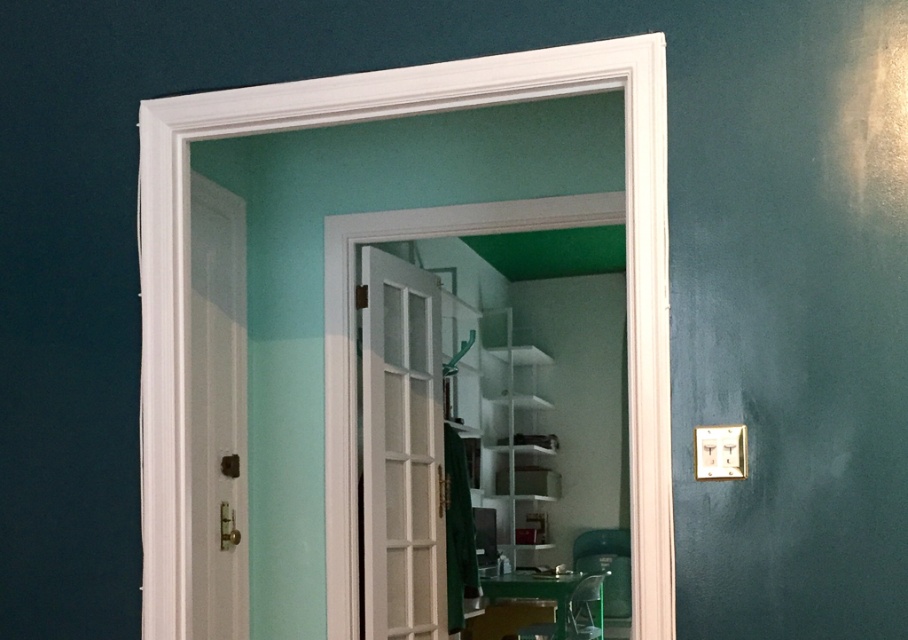
Is white glossy door at center to the left of white glossy bookshelf at center from the viewer's perspective?

Indeed, white glossy door at center is positioned on the left side of white glossy bookshelf at center.

Is white glossy door at center wider than white glossy bookshelf at center?

Incorrect, white glossy door at center's width does not surpass white glossy bookshelf at center's.

Does point (377, 388) come farther from viewer compared to point (522, 346)?

No, (377, 388) is in front of (522, 346).

This screenshot has width=908, height=640. I want to click on white glossy door at center, so click(x=401, y=451).

Is white glossy door at left further to the viewer compared to white glossy bookshelf at center?

That is False.

Between point (229, 460) and point (531, 448), which one is positioned behind?

Point (531, 448)

The height and width of the screenshot is (640, 908). I want to click on white glossy door at left, so (218, 412).

Is point (487, 436) farther from viewer compared to point (541, 582)?

That is True.

Which is behind, point (525, 499) or point (565, 618)?

The point (525, 499) is behind.

Is point (539, 346) positioned in front of point (588, 580)?

No, it is not.

The width and height of the screenshot is (908, 640). In order to click on white glossy bookshelf at center in this screenshot , I will do `click(518, 436)`.